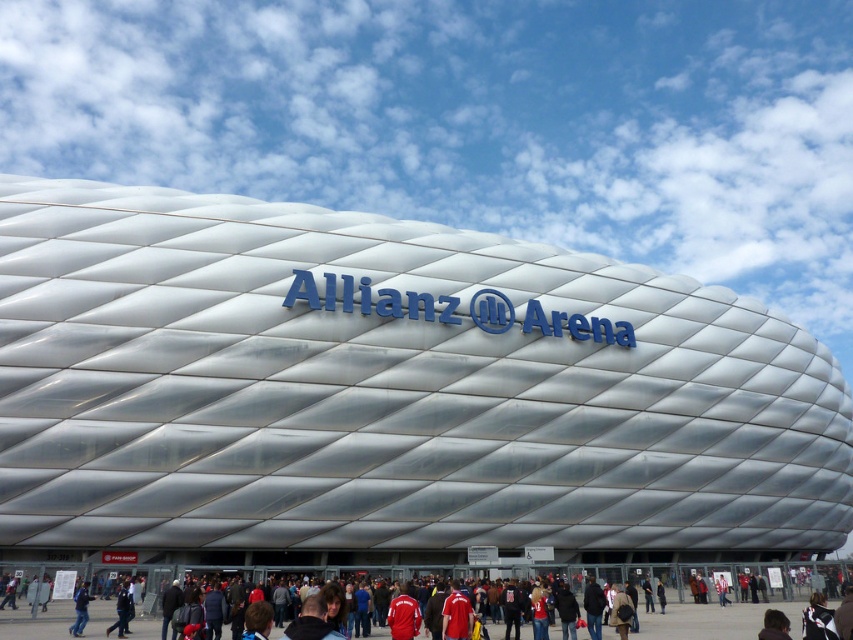
You are standing at the entrance of the Allianz Arena and want to take a photo of the two points marked on the roof. Which point, point (381,572) or point (80,624), is closer to you?

Point (381,572) is further to the viewer than point (80,624), so point (80,624) is closer to you.

You are a delivery person who needs to place a package between the red fabric jacket at center and the blue fabric jacket at lower left. The package requires a minimum of 40 feet of space. Can you fit it there?

The red fabric jacket at center and blue fabric jacket at lower left are 43.84 feet apart from each other, so yes, the package can be placed between them as the distance is sufficient to accommodate the required space.

You are attending a football match at the Allianz Arena and notice two jackets in the crowd. The red fabric jacket at center and the blue fabric jacket at lower left. Which jacket is located to the right of the other?

The red fabric jacket at center is positioned on the right side of blue fabric jacket at lower left.